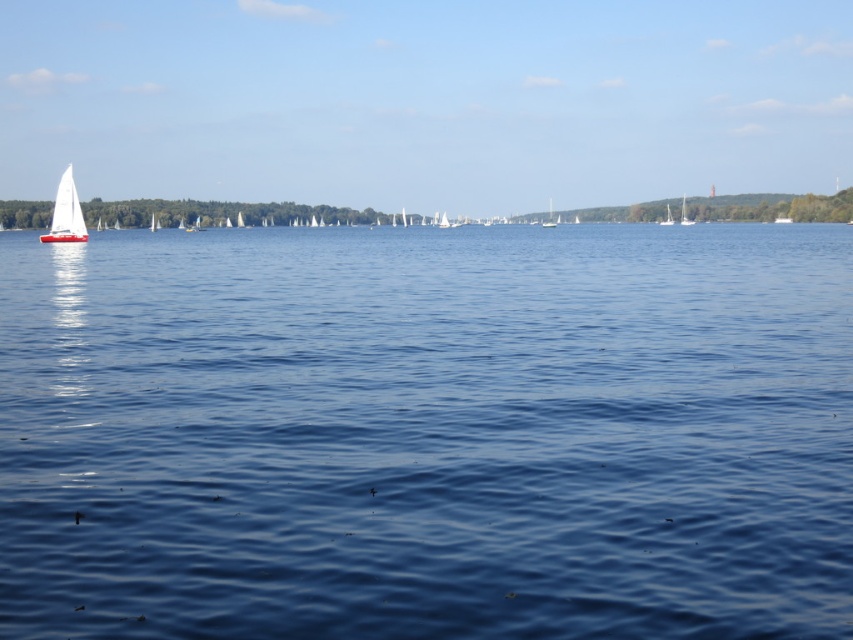
Question: Can you confirm if blue water at center is wider than white matte sailboat at upper right?

Choices:
 (A) no
 (B) yes

Answer: (B)

Question: Among these points, which one is farthest from the camera?

Choices:
 (A) (55, 241)
 (B) (665, 216)

Answer: (B)

Question: Does white matte sailboat at left appear on the left side of white sailboat at center?

Choices:
 (A) no
 (B) yes

Answer: (B)

Question: Which point is farther from the camera taking this photo?

Choices:
 (A) (57, 236)
 (B) (670, 220)
 (C) (280, 524)
 (D) (550, 211)

Answer: (D)

Question: Is white sailboat at center above white matte sailboat at upper right?

Choices:
 (A) yes
 (B) no

Answer: (A)

Question: Which point is closer to the camera?

Choices:
 (A) coord(670,216)
 (B) coord(549,198)
 (C) coord(161,547)

Answer: (C)